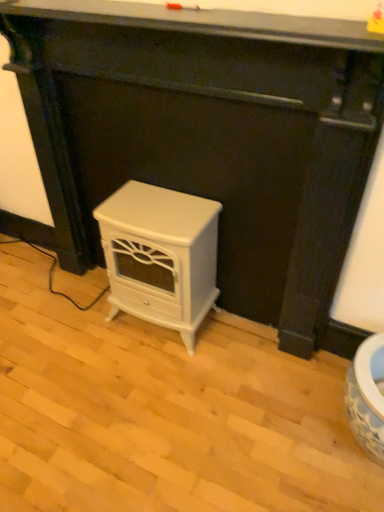
Locate an element on the screen. This screenshot has height=512, width=384. white glossy electric stove at center, arranged as the second furniture when viewed from the right is located at coordinates (160, 255).

The width and height of the screenshot is (384, 512). What are the coordinates of `white glossy stove at center, placed as the 2th furniture when sorted from left to right` in the screenshot? It's located at (209, 136).

From the image's perspective, relative to white glossy stove at center, which is the first furniture in right-to-left order, is smooth black surface at upper center above or below?

Based on their image positions, smooth black surface at upper center is located above white glossy stove at center, which is the first furniture in right-to-left order.

Considering the relative positions of smooth black surface at upper center and white glossy stove at center, placed as the 2th furniture when sorted from left to right, in the image provided, is smooth black surface at upper center to the right of white glossy stove at center, placed as the 2th furniture when sorted from left to right, from the viewer's perspective?

Incorrect, smooth black surface at upper center is not on the right side of white glossy stove at center, placed as the 2th furniture when sorted from left to right.

From a real-world perspective, is smooth black surface at upper center physically located above or below white glossy stove at center, which is the first furniture in right-to-left order?

smooth black surface at upper center is above white glossy stove at center, which is the first furniture in right-to-left order.

How different are the orientations of smooth black surface at upper center and white glossy stove at center, placed as the 2th furniture when sorted from left to right, in degrees?

smooth black surface at upper center and white glossy stove at center, placed as the 2th furniture when sorted from left to right, are facing 0.003 degrees away from each other.

Which object is positioned more to the left, white glossy stove at center, which is the first furniture in right-to-left order, or smooth black surface at upper center?

smooth black surface at upper center is more to the left.

Looking at the image, does white glossy stove at center, placed as the 2th furniture when sorted from left to right, seem bigger or smaller compared to smooth black surface at upper center?

white glossy stove at center, placed as the 2th furniture when sorted from left to right, is bigger than smooth black surface at upper center.

At what (x,y) coordinates should I click in order to perform the action: click on counter top on the left of white glossy stove at center, which is the first furniture in right-to-left order. Please return your answer as a coordinate pair (x, y). The height and width of the screenshot is (512, 384). Looking at the image, I should click on (206, 22).

Would you consider white glossy stove at center, placed as the 2th furniture when sorted from left to right, to be distant from smooth black surface at upper center?

white glossy stove at center, placed as the 2th furniture when sorted from left to right, is actually quite close to smooth black surface at upper center.

Identify the location of furniture below the white glossy stove at center, which is the first furniture in right-to-left order (from the image's perspective). (160, 255).

Is white glossy electric stove at center, arranged as the second furniture when viewed from the right, aimed at white glossy stove at center, which is the first furniture in right-to-left order?

Yes, white glossy electric stove at center, arranged as the second furniture when viewed from the right, is oriented towards white glossy stove at center, which is the first furniture in right-to-left order.

From the image's perspective, is white glossy electric stove at center, the 1th furniture positioned from the left, over white glossy stove at center, placed as the 2th furniture when sorted from left to right?

Actually, white glossy electric stove at center, the 1th furniture positioned from the left, appears below white glossy stove at center, placed as the 2th furniture when sorted from left to right, in the image.

Which point is more distant from viewer, (113, 285) or (295, 216)?

Point (113, 285)

Is white glossy electric stove at center, the 1th furniture positioned from the left, beside smooth black surface at upper center?

No, white glossy electric stove at center, the 1th furniture positioned from the left, is not in contact with smooth black surface at upper center.

At what (x,y) coordinates should I click in order to perform the action: click on furniture that is the 2nd object directly below the smooth black surface at upper center (from a real-world perspective). Please return your answer as a coordinate pair (x, y). Looking at the image, I should click on (160, 255).

From the image's perspective, which one is positioned lower, white glossy electric stove at center, the 1th furniture positioned from the left, or smooth black surface at upper center?

white glossy electric stove at center, the 1th furniture positioned from the left.

Is white glossy electric stove at center, arranged as the second furniture when viewed from the right, facing towards smooth black surface at upper center?

Answer: No, white glossy electric stove at center, arranged as the second furniture when viewed from the right, is not turned towards smooth black surface at upper center.

Is white glossy electric stove at center, arranged as the second furniture when viewed from the right, inside white glossy stove at center, placed as the 2th furniture when sorted from left to right?

Yes, white glossy stove at center, placed as the 2th furniture when sorted from left to right, contains white glossy electric stove at center, arranged as the second furniture when viewed from the right.

From the image's perspective, is white glossy stove at center, which is the first furniture in right-to-left order, located above white glossy electric stove at center, the 1th furniture positioned from the left?

Yes.

Is white glossy stove at center, placed as the 2th furniture when sorted from left to right, turned away from white glossy electric stove at center, the 1th furniture positioned from the left?

Yes, white glossy electric stove at center, the 1th furniture positioned from the left, is at the back of white glossy stove at center, placed as the 2th furniture when sorted from left to right.

Considering the positions of objects smooth black surface at upper center and white glossy electric stove at center, the 1th furniture positioned from the left, in the image provided, who is in front, smooth black surface at upper center or white glossy electric stove at center, the 1th furniture positioned from the left,?

smooth black surface at upper center is more forward.

Identify the location of counter top in front of the white glossy electric stove at center, arranged as the second furniture when viewed from the right. Image resolution: width=384 pixels, height=512 pixels. (206, 22).

Do you think smooth black surface at upper center is within white glossy electric stove at center, the 1th furniture positioned from the left, or outside of it?

smooth black surface at upper center is not enclosed by white glossy electric stove at center, the 1th furniture positioned from the left.

Is point (370, 47) less distant than point (111, 319)?

That is True.

This screenshot has height=512, width=384. In order to click on counter top that is above the white glossy stove at center, placed as the 2th furniture when sorted from left to right (from the image's perspective) in this screenshot , I will do `click(206, 22)`.

There is a smooth black surface at upper center. Where is `the 1st furniture below it (from the image's perspective)`? The height and width of the screenshot is (512, 384). the 1st furniture below it (from the image's perspective) is located at coordinates (209, 136).

Which object lies further to the anchor point white glossy stove at center, placed as the 2th furniture when sorted from left to right, smooth black surface at upper center or white glossy electric stove at center, arranged as the second furniture when viewed from the right?

smooth black surface at upper center lies further to white glossy stove at center, placed as the 2th furniture when sorted from left to right, than the other object.

From the picture: Based on their spatial positions, is white glossy electric stove at center, the 1th furniture positioned from the left, or white glossy stove at center, which is the first furniture in right-to-left order, closer to smooth black surface at upper center?

white glossy stove at center, which is the first furniture in right-to-left order.

From the image, which object appears to be farther from white glossy stove at center, placed as the 2th furniture when sorted from left to right, white glossy electric stove at center, arranged as the second furniture when viewed from the right, or smooth black surface at upper center?

smooth black surface at upper center is further to white glossy stove at center, placed as the 2th furniture when sorted from left to right.

Looking at the image, which one is located closer to white glossy electric stove at center, arranged as the second furniture when viewed from the right, white glossy stove at center, which is the first furniture in right-to-left order, or smooth black surface at upper center?

white glossy stove at center, which is the first furniture in right-to-left order, is closer to white glossy electric stove at center, arranged as the second furniture when viewed from the right.

Looking at the image, which one is located further to white glossy electric stove at center, the 1th furniture positioned from the left, smooth black surface at upper center or white glossy stove at center, which is the first furniture in right-to-left order?

smooth black surface at upper center is positioned further to the anchor white glossy electric stove at center, the 1th furniture positioned from the left.

From the image, which object appears to be nearer to smooth black surface at upper center, white glossy stove at center, placed as the 2th furniture when sorted from left to right, or white glossy electric stove at center, arranged as the second furniture when viewed from the right?

Based on the image, white glossy stove at center, placed as the 2th furniture when sorted from left to right, appears to be nearer to smooth black surface at upper center.

Where is `furniture between smooth black surface at upper center and white glossy electric stove at center, arranged as the second furniture when viewed from the right, in the up-down direction`? This screenshot has width=384, height=512. furniture between smooth black surface at upper center and white glossy electric stove at center, arranged as the second furniture when viewed from the right, in the up-down direction is located at coordinates (209, 136).